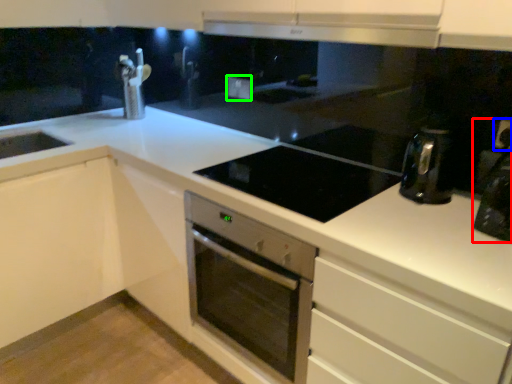
Question: Which is nearer to the coffee machine (highlighted by a red box)? electric outlet (highlighted by a blue box) or electric outlet (highlighted by a green box).

Choices:
 (A) electric outlet
 (B) electric outlet

Answer: (A)